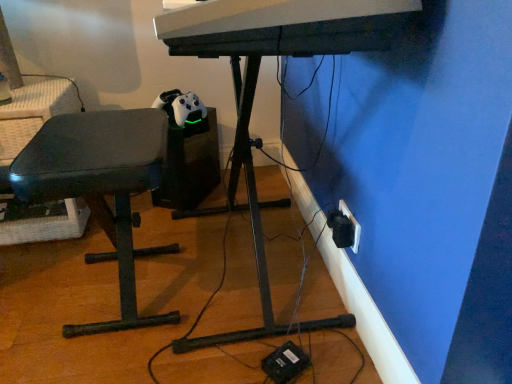
Question: Can you confirm if matte black bench at left is positioned to the left of white plastic computer desk at center?

Choices:
 (A) yes
 (B) no

Answer: (A)

Question: Is matte black bench at left not within white plastic computer desk at center?

Choices:
 (A) yes
 (B) no

Answer: (A)

Question: From a real-world perspective, is matte black bench at left located beneath white plastic computer desk at center?

Choices:
 (A) yes
 (B) no

Answer: (A)

Question: Can you confirm if matte black bench at left is bigger than white plastic computer desk at center?

Choices:
 (A) no
 (B) yes

Answer: (A)

Question: Does matte black bench at left have a lesser width compared to white plastic computer desk at center?

Choices:
 (A) yes
 (B) no

Answer: (A)

Question: From a real-world perspective, does matte black bench at left stand above white plastic computer desk at center?

Choices:
 (A) no
 (B) yes

Answer: (A)

Question: Does white plastic computer desk at center turn towards matte black bench at left?

Choices:
 (A) no
 (B) yes

Answer: (B)

Question: Is white plastic computer desk at center taller than matte black bench at left?

Choices:
 (A) no
 (B) yes

Answer: (B)

Question: From the image's perspective, is white plastic computer desk at center under matte black bench at left?

Choices:
 (A) yes
 (B) no

Answer: (B)

Question: From a real-world perspective, is white plastic computer desk at center on matte black bench at left?

Choices:
 (A) yes
 (B) no

Answer: (A)

Question: Is white plastic computer desk at center further to the viewer compared to matte black bench at left?

Choices:
 (A) no
 (B) yes

Answer: (A)

Question: Is white plastic computer desk at center turned away from matte black bench at left?

Choices:
 (A) no
 (B) yes

Answer: (B)

Question: Would you consider white plastic electric outlet at lower right to be distant from matte black bench at left?

Choices:
 (A) yes
 (B) no

Answer: (B)